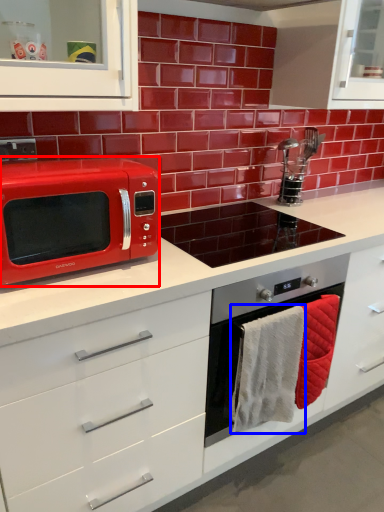
Question: Which point is closer to the camera, microwave oven (highlighted by a red box) or hand towel (highlighted by a blue box)?

Choices:
 (A) microwave oven
 (B) hand towel

Answer: (A)